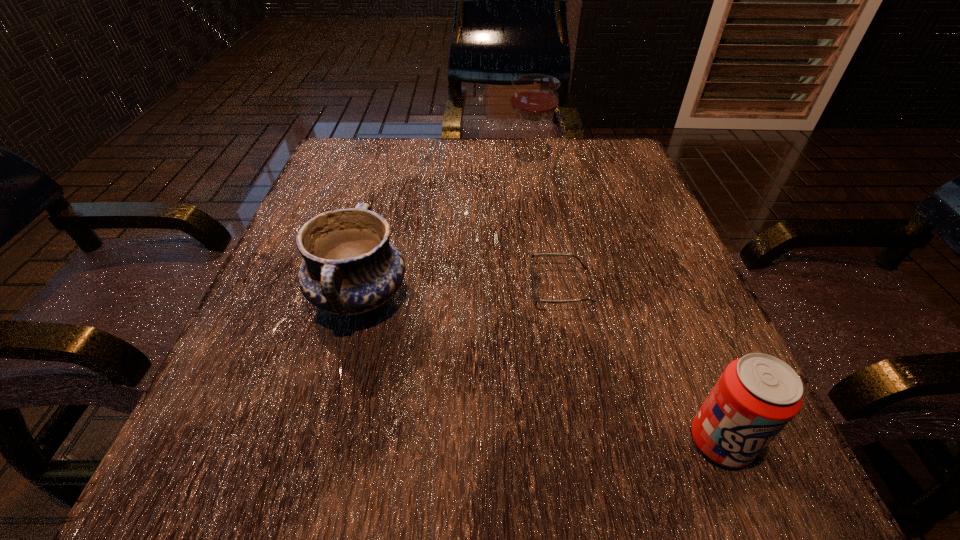
The width and height of the screenshot is (960, 540). What are the coordinates of `free region located 0.220m on the front-facing side of the sunglasses` in the screenshot? It's located at (400, 287).

What are the coordinates of `free space located on the front-facing side of the sunglasses` in the screenshot? It's located at (400, 287).

Find the location of a particular element. Image resolution: width=960 pixels, height=540 pixels. object at the far edge is located at coordinates tap(534, 97).

Identify the location of object that is at the near edge. Image resolution: width=960 pixels, height=540 pixels. (756, 396).

Locate an element on the screen. This screenshot has width=960, height=540. object located in the left edge section of the desktop is located at coordinates (350, 267).

Identify the location of object located in the right edge section of the desktop. (756, 396).

Identify the location of object located in the near right corner section of the desktop. (756, 396).

In the image, there is a desktop. At what (x,y) coordinates should I click in order to perform the action: click on free space at the far edge. Please return your answer as a coordinate pair (x, y). The image size is (960, 540). Looking at the image, I should click on [435, 154].

In the image, there is a desktop. Identify the location of free space at the near edge. This screenshot has height=540, width=960. (363, 502).

In the image, there is a desktop. Where is `vacant space at the left edge`? vacant space at the left edge is located at coordinates (289, 293).